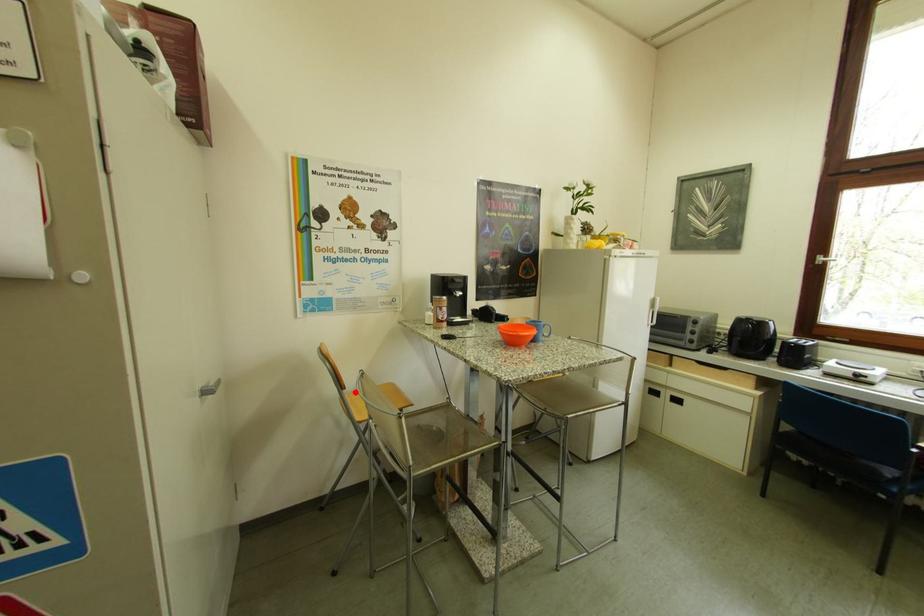
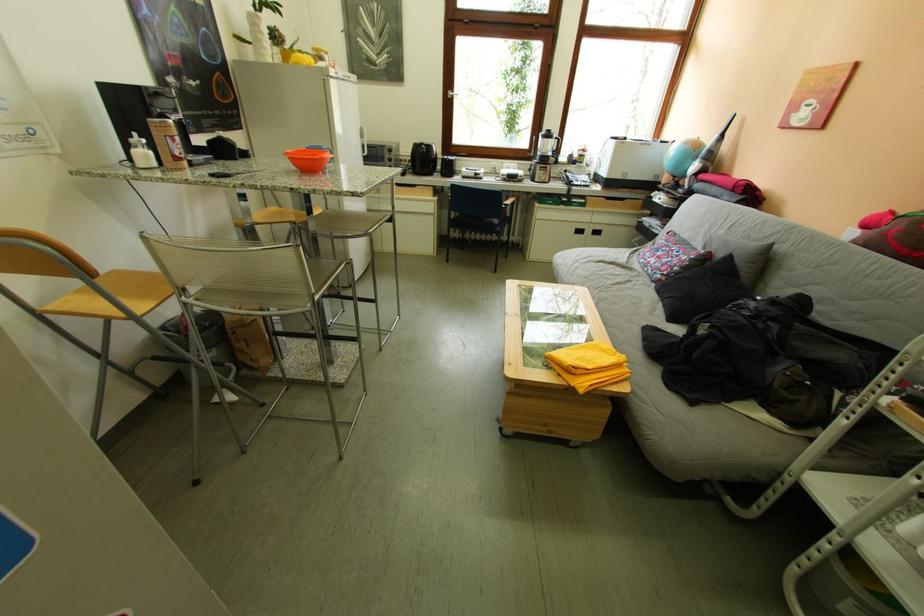
Where in the second image is the point corresponding to the highlighted location from the first image?

(106, 280)